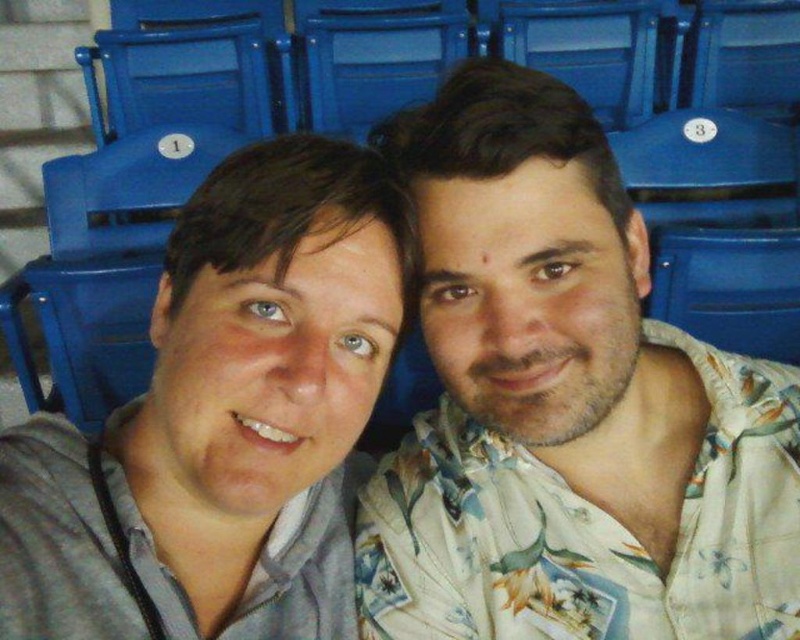
You are sitting in a blue plastic chair at upper center and want to hand a snack to the person wearing the floral shirt at center. Can you reach them without moving your chair?

The floral shirt at center has a lesser height compared to the blue plastic chair at upper center, so yes, you can reach the person wearing the floral shirt at center since they are shorter than your chair.

You are taking a photo of two people sitting on stadium bleachers. The first person is at point [282,362] and the second is at point [325,113]. Which person is closer to the camera?

The person at point [282,362] is closer to the camera than the person at point [325,113].

You are sitting in the blue plastic chair at center and want to hand a snack to the person wearing the floral shirt at center. Which direction should you move your arm to reach them?

The floral shirt at center is to the left of the blue plastic chair at center, so you should move your arm to the left to reach them.